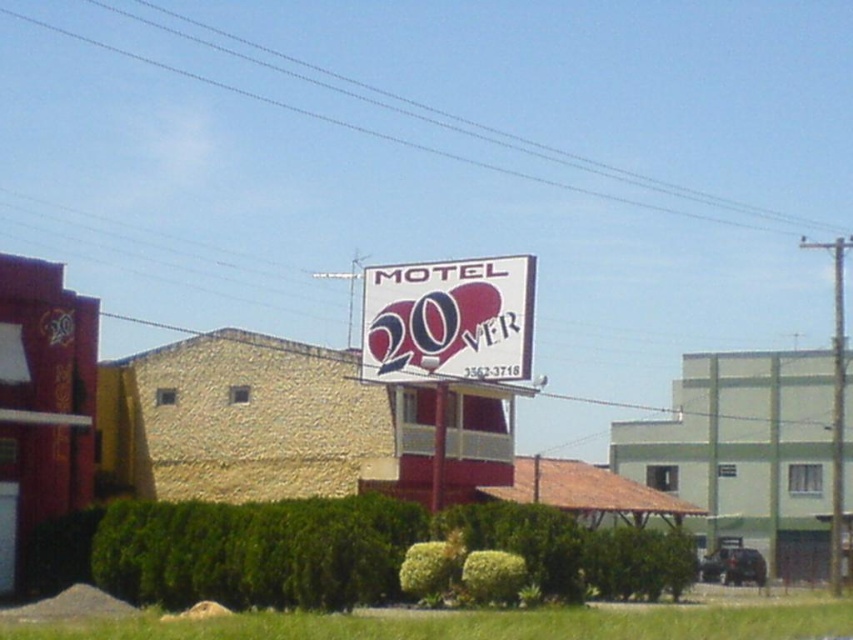
Does white plastic sign at center have a smaller size compared to white plastic pole at center?

No, white plastic sign at center is not smaller than white plastic pole at center.

Between white plastic sign at center and white plastic pole at center, which one is positioned lower?

white plastic pole at center is below.

I want to click on white plastic sign at center, so click(x=450, y=320).

The width and height of the screenshot is (853, 640). What are the coordinates of `white plastic sign at center` in the screenshot? It's located at (450, 320).